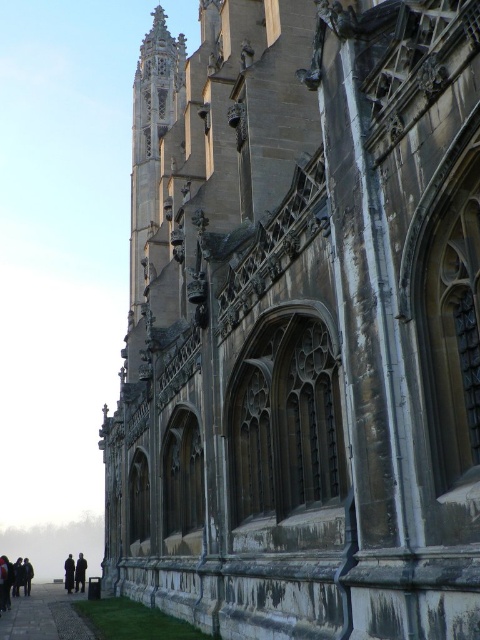
You are a visitor standing at the entrance of the Gothic building. You see a paved stone path at lower left and a dark gray coat at lower left. Which object is wider?

The dark gray coat at lower left is wider than the paved stone path at lower left.

You are standing in front of the Gothic building and notice two items at the lower left corner of the image. Which one is closer to you between the dark brown coat at lower left and the dark gray jacket at lower left?

The dark brown coat at lower left is closer to you because the dark gray jacket at lower left is behind it.